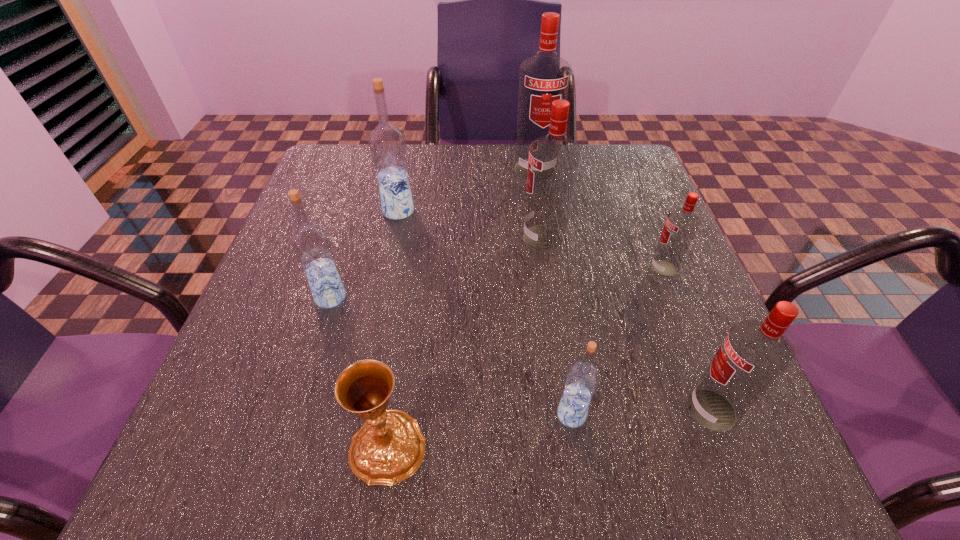
The width and height of the screenshot is (960, 540). Identify the location of the smallest red vodka. (681, 225).

The width and height of the screenshot is (960, 540). What are the coordinates of `the nearest blue vodka` in the screenshot? It's located at (582, 378).

Where is `the smallest blue vodka`? This screenshot has height=540, width=960. the smallest blue vodka is located at coordinates (x=582, y=378).

This screenshot has height=540, width=960. What are the coordinates of `gold chalice` in the screenshot? It's located at (389, 447).

Find the location of a particular element. This screenshot has width=960, height=540. free space located 0.360m on the front label of the biggest red vodka is located at coordinates (554, 289).

Locate an element on the screen. The image size is (960, 540). blank space located 0.160m on the left of the biggest blue vodka is located at coordinates pyautogui.click(x=312, y=211).

The width and height of the screenshot is (960, 540). What are the coordinates of `free location located on the front label of the third farthest object` in the screenshot? It's located at (498, 238).

Where is `vacant area situated 0.360m on the front label of the third farthest object`? vacant area situated 0.360m on the front label of the third farthest object is located at coordinates (354, 238).

In order to click on free space located on the front label of the third farthest object in this screenshot , I will do `click(349, 238)`.

The height and width of the screenshot is (540, 960). Identify the location of vacant space located 0.340m on the back of the leftmost blue vodka. (366, 185).